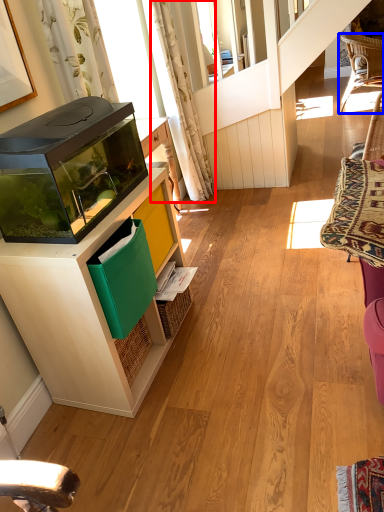
Question: Which object is further to the camera taking this photo, curtain (highlighted by a red box) or chair (highlighted by a blue box)?

Choices:
 (A) curtain
 (B) chair

Answer: (B)